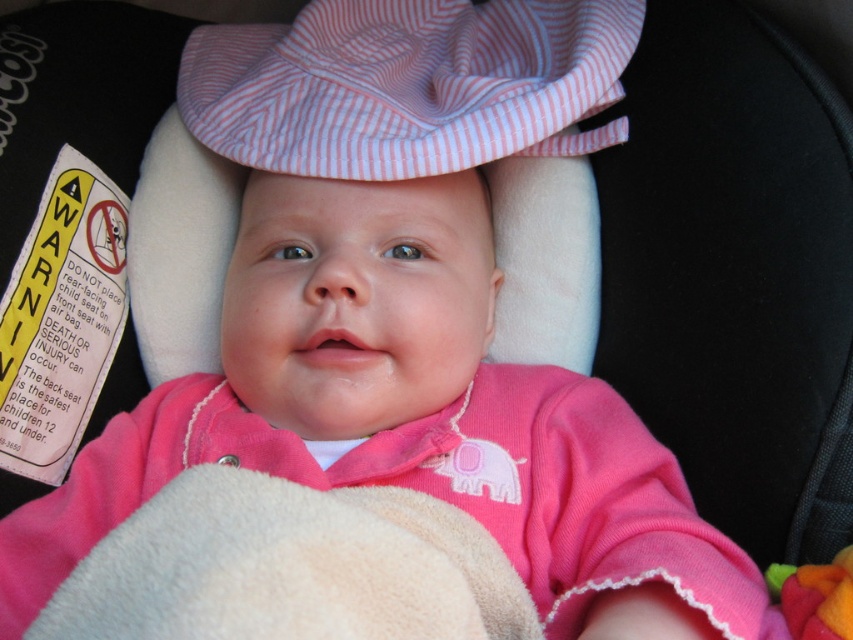
Question: Can you confirm if pink striped fabric hat at upper center is smaller than fluffy felt toy at lower right?

Choices:
 (A) yes
 (B) no

Answer: (B)

Question: Which of the following is the farthest from the observer?

Choices:
 (A) (833, 595)
 (B) (517, 77)

Answer: (B)

Question: Is pink striped fabric hat at upper center above fluffy felt toy at lower right?

Choices:
 (A) no
 (B) yes

Answer: (B)

Question: Can you confirm if pink striped fabric hat at upper center is positioned to the left of fluffy felt toy at lower right?

Choices:
 (A) yes
 (B) no

Answer: (A)

Question: Which of the following is the closest to the observer?

Choices:
 (A) (770, 573)
 (B) (540, 8)

Answer: (A)